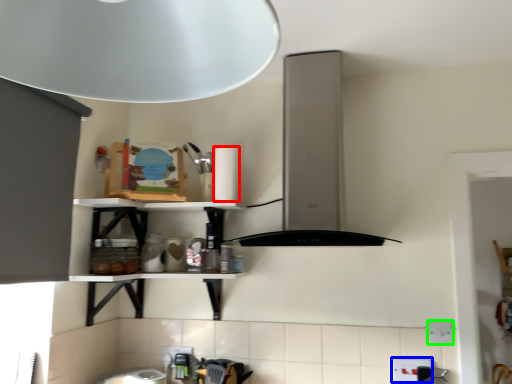
Question: Which object is the closest to the paper towel (highlighted by a red box)? Choose among these: electric outlet (highlighted by a blue box) or electric outlet (highlighted by a green box).

Choices:
 (A) electric outlet
 (B) electric outlet

Answer: (A)